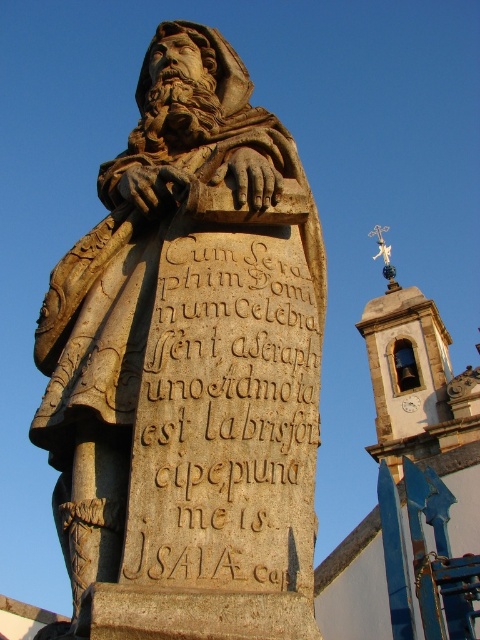
Question: Which of the following is the farthest from the observer?

Choices:
 (A) (256, 438)
 (B) (141, 99)

Answer: (B)

Question: Can you confirm if stone statue at center is smaller than brown stone inscription at center?

Choices:
 (A) yes
 (B) no

Answer: (B)

Question: Which of the following is the closest to the observer?

Choices:
 (A) stone statue at center
 (B) brown stone inscription at center

Answer: (A)

Question: Considering the relative positions of stone statue at center and brown stone inscription at center in the image provided, where is stone statue at center located with respect to brown stone inscription at center?

Choices:
 (A) right
 (B) left

Answer: (B)

Question: Is stone statue at center bigger than brown stone inscription at center?

Choices:
 (A) no
 (B) yes

Answer: (B)